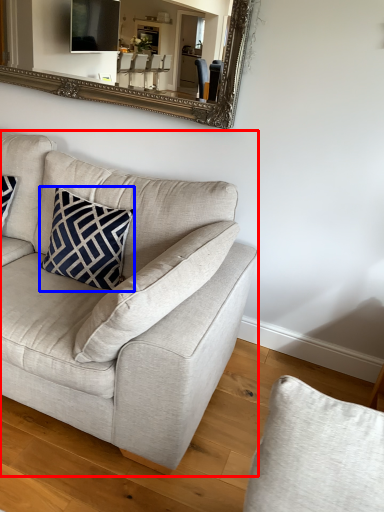
Question: Which object is closer to the camera taking this photo, studio couch (highlighted by a red box) or pillow (highlighted by a blue box)?

Choices:
 (A) studio couch
 (B) pillow

Answer: (A)